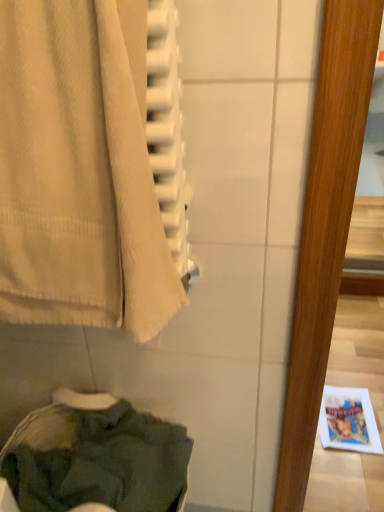
Question: Considering the positions of dark green fabric at lower left and beige cotton towel at left in the image, is dark green fabric at lower left taller or shorter than beige cotton towel at left?

Choices:
 (A) tall
 (B) short

Answer: (A)

Question: Would you say dark green fabric at lower left is to the left or to the right of beige cotton towel at left in the picture?

Choices:
 (A) right
 (B) left

Answer: (B)

Question: Does point (100, 474) appear closer or farther from the camera than point (61, 142)?

Choices:
 (A) farther
 (B) closer

Answer: (A)

Question: From the image's perspective, is beige cotton towel at left above or below dark green fabric at lower left?

Choices:
 (A) above
 (B) below

Answer: (A)

Question: Considering the positions of point [x=140, y=111] and point [x=82, y=394], is point [x=140, y=111] closer or farther from the camera than point [x=82, y=394]?

Choices:
 (A) farther
 (B) closer

Answer: (B)

Question: From a real-world perspective, is beige cotton towel at left physically located above or below dark green fabric at lower left?

Choices:
 (A) below
 (B) above

Answer: (B)

Question: Considering their positions, is beige cotton towel at left located in front of or behind dark green fabric at lower left?

Choices:
 (A) front
 (B) behind

Answer: (A)